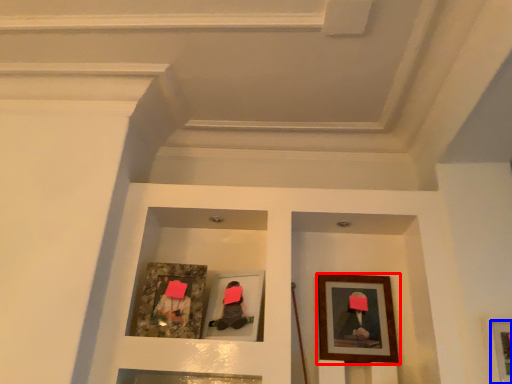
Question: Among these objects, which one is farthest to the camera, picture frame (highlighted by a red box) or picture frame (highlighted by a blue box)?

Choices:
 (A) picture frame
 (B) picture frame

Answer: (A)